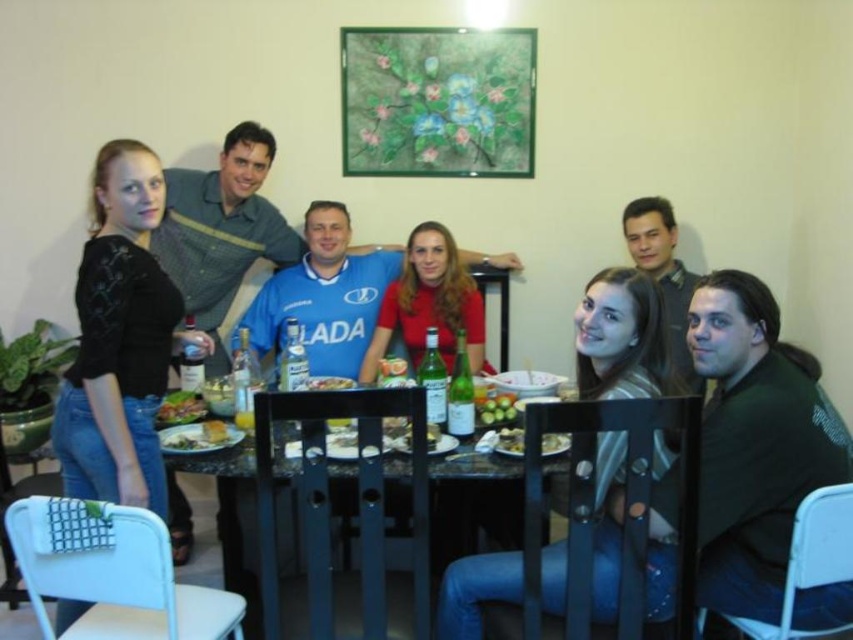
Can you confirm if smooth white bread at table center is positioned below smooth white plate at center?

Yes.

Is smooth white bread at table center positioned in front of smooth white plate at center?

Yes.

Which is in front, point (198, 448) or point (431, 442)?

Positioned in front is point (198, 448).

Locate an element on the screen. The image size is (853, 640). smooth white bread at table center is located at coordinates (196, 436).

Is green leafy salad at table center thinner than smooth yellow bread at center?

No.

Is point (165, 410) behind point (225, 429)?

Yes.

The height and width of the screenshot is (640, 853). In order to click on green leafy salad at table center in this screenshot , I will do `click(181, 406)`.

Who is higher up, black glass table at center or smooth yellow bread at center?

smooth yellow bread at center

In the scene shown: Who is positioned more to the left, black glass table at center or smooth yellow bread at center?

smooth yellow bread at center

Which is in front, point (274, 458) or point (224, 433)?

Point (274, 458)

Where is `black glass table at center`? This screenshot has height=640, width=853. black glass table at center is located at coordinates (236, 512).